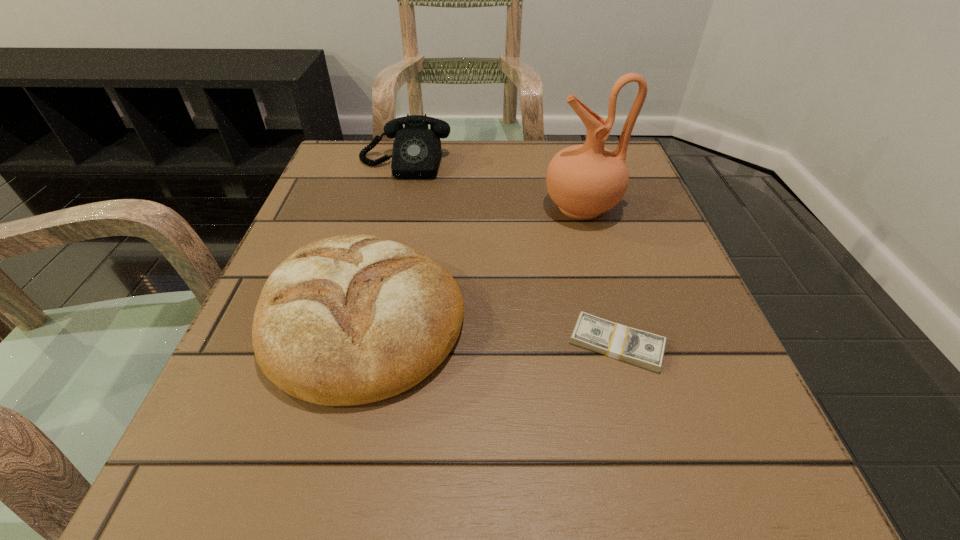
Where is `empty location between the dollar and the pottery`? This screenshot has width=960, height=540. empty location between the dollar and the pottery is located at coordinates 599,275.

The width and height of the screenshot is (960, 540). Identify the location of free space between the pottery and the telephone. (492, 186).

This screenshot has width=960, height=540. Find the location of `object that stands as the second closest to the telephone`. object that stands as the second closest to the telephone is located at coordinates (353, 319).

Choose which object is the third nearest neighbor to the tallest object. Please provide its 2D coordinates. Your answer should be formatted as a tuple, i.e. [(x, y)], where the tuple contains the x and y coordinates of a point satisfying the conditions above.

[(640, 348)]

Where is `vacant region that satisfies the following two spatial constraints: 1. on the dial of the dollar; 2. on the left side of the farthest object`? Image resolution: width=960 pixels, height=540 pixels. vacant region that satisfies the following two spatial constraints: 1. on the dial of the dollar; 2. on the left side of the farthest object is located at coordinates (361, 343).

Identify the location of vacant space that satisfies the following two spatial constraints: 1. on the spout of the tallest object; 2. on the front side of the bread. The image size is (960, 540). (613, 319).

Identify the location of free space that satisfies the following two spatial constraints: 1. on the dial of the shortest object; 2. on the right side of the farthest object. Image resolution: width=960 pixels, height=540 pixels. (361, 343).